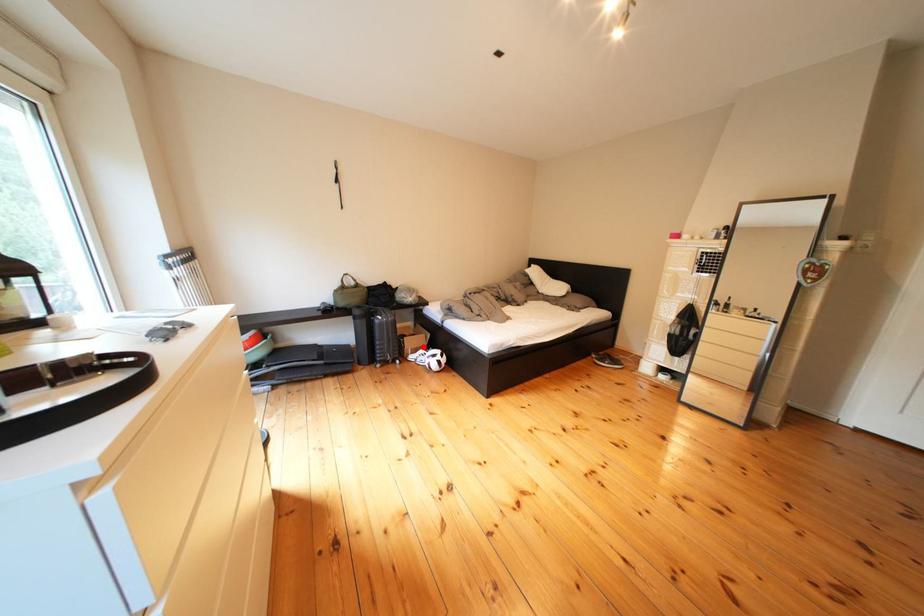
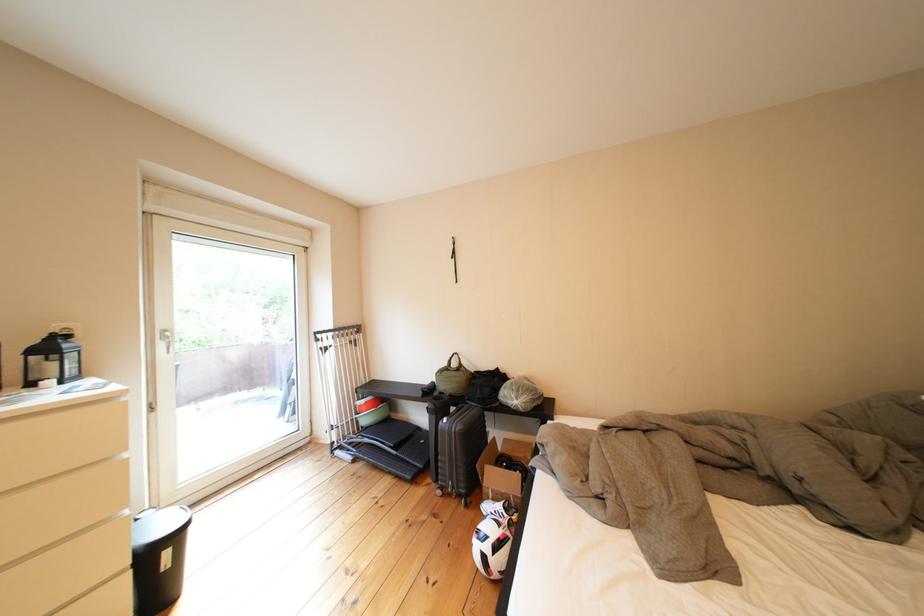
Locate, in the second image, the point that corresponds to the highlighted location in the first image.

(505, 480)